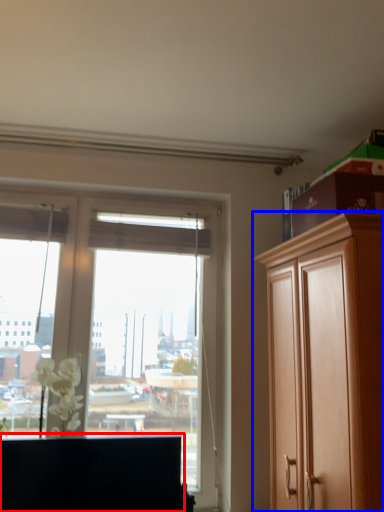
Question: Among these objects, which one is farthest to the camera, cabinetry (highlighted by a red box) or cabinetry (highlighted by a blue box)?

Choices:
 (A) cabinetry
 (B) cabinetry

Answer: (A)